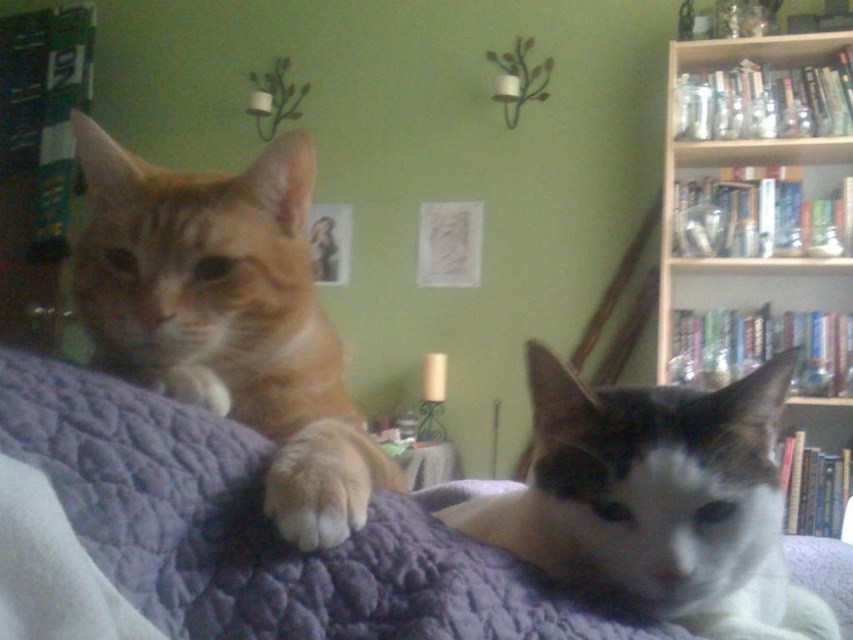
Is purple quilted bed at center positioned at the back of wooden bookshelf at upper right?

That is False.

Who is more distant from viewer, (511, 557) or (683, 145)?

The point (683, 145) is more distant.

Is point (157, 588) positioned in front of point (838, 323)?

Yes, point (157, 588) is in front of point (838, 323).

This screenshot has width=853, height=640. Identify the location of purple quilted bed at center. (263, 531).

This screenshot has height=640, width=853. I want to click on orange fur cat at left, so click(228, 317).

Is point (315, 461) closer to viewer compared to point (815, 122)?

Yes, point (315, 461) is closer to viewer.

Who is more distant from viewer, (207, 374) or (722, 292)?

Positioned behind is point (722, 292).

Locate an element on the screen. This screenshot has width=853, height=640. orange fur cat at left is located at coordinates (228, 317).

Between purple quilted bed at center and white fur cat at center, which one appears on the right side from the viewer's perspective?

white fur cat at center is more to the right.

Locate an element on the screen. purple quilted bed at center is located at coordinates (263, 531).